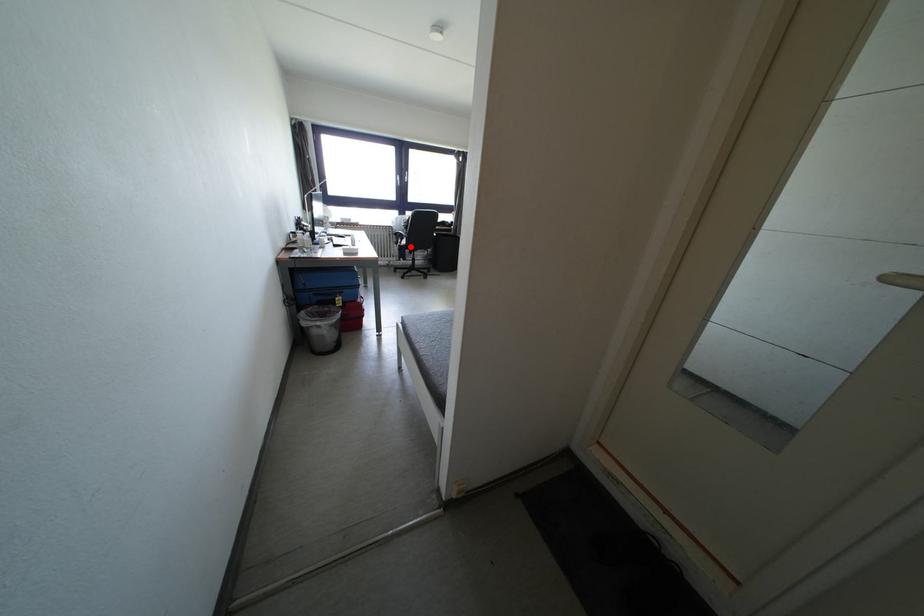
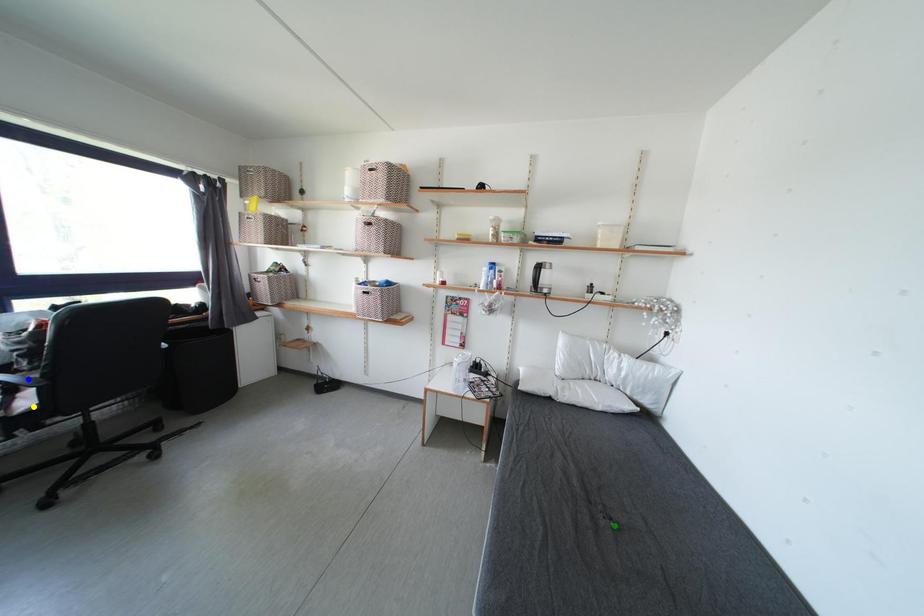
Question: I am providing you with two images of the same scene from different viewpoints. A red point is marked on the first image. You are given multiple points on the second image. In image 2, which mark is for the same physical point as the one in image 1?

Choices:
 (A) blue point
 (B) yellow point
 (C) green point

Answer: (B)